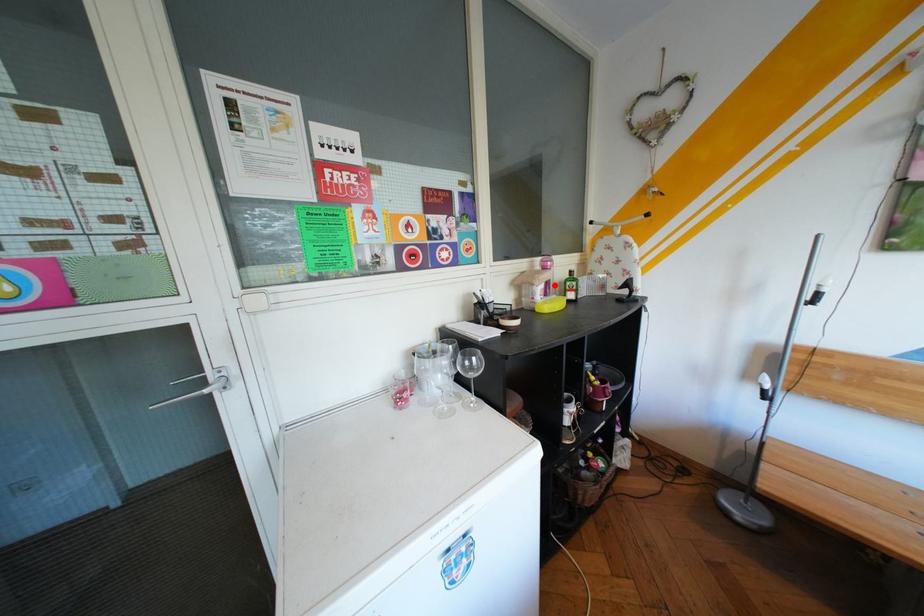
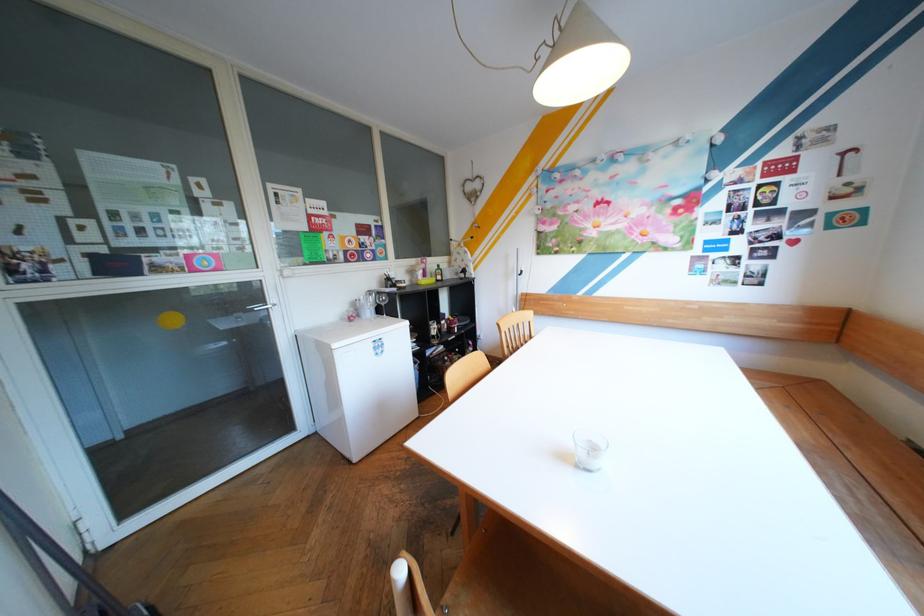
Question: I am providing you with two images of the same scene from different viewpoints. A red point is shown in image1. For the corresponding object point in image2, is it positioned nearer or farther from the camera?

Choices:
 (A) Nearer
 (B) Farther

Answer: (A)